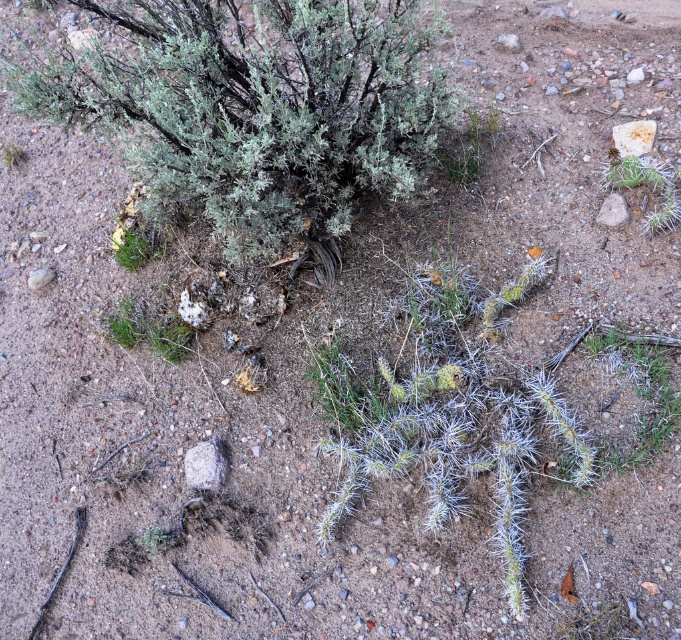
Who is shorter, green fuzzy plant at lower left or green fuzzy bush at upper left?

green fuzzy bush at upper left

Between point (138, 307) and point (142, 236), which one is positioned in front?

Point (138, 307) is more forward.

This screenshot has height=640, width=681. What are the coordinates of `green fuzzy plant at lower left` in the screenshot? It's located at (146, 330).

Is green fuzzy bush at upper center shorter than green spiny cactus at lower right?

No, green fuzzy bush at upper center is not shorter than green spiny cactus at lower right.

Which is in front, point (238, 28) or point (620, 168)?

Point (238, 28) is more forward.

The image size is (681, 640). What are the coordinates of `green fuzzy bush at upper center` in the screenshot? It's located at (253, 106).

Does green fuzzy plant at lower left appear on the right side of green spiny cactus at lower right?

In fact, green fuzzy plant at lower left is to the left of green spiny cactus at lower right.

Does green fuzzy plant at lower left have a lesser width compared to green spiny cactus at lower right?

In fact, green fuzzy plant at lower left might be wider than green spiny cactus at lower right.

Does point (165, 320) come in front of point (648, 173)?

No, (165, 320) is further to viewer.

Where is `green fuzzy plant at lower left`? This screenshot has width=681, height=640. green fuzzy plant at lower left is located at coordinates (146, 330).